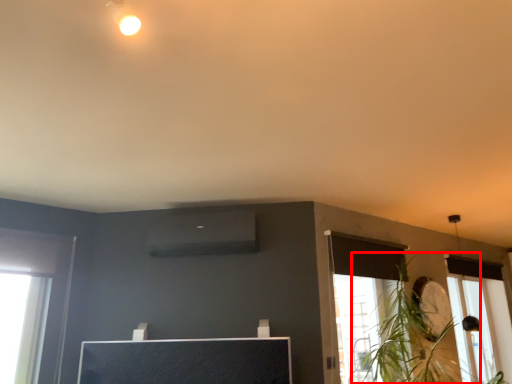
Question: In this image, where is plant (annotated by the red box) located relative to window?

Choices:
 (A) right
 (B) left

Answer: (B)